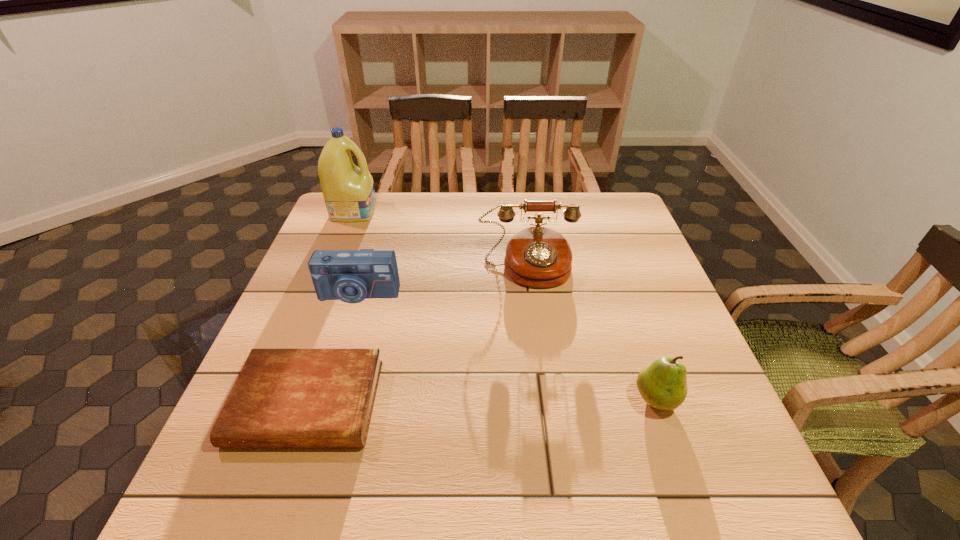
Locate an element on the screen. vacant space at the right edge of the desktop is located at coordinates (717, 417).

Locate an element on the screen. vacant space at the far left corner of the desktop is located at coordinates (385, 197).

The width and height of the screenshot is (960, 540). In order to click on vacant area at the far right corner of the desktop in this screenshot , I will do `click(587, 199)`.

The width and height of the screenshot is (960, 540). I want to click on vacant point located between the rightmost object and the second object from right to left, so pyautogui.click(x=592, y=333).

Where is `vacant region between the Bible and the telephone`? Image resolution: width=960 pixels, height=540 pixels. vacant region between the Bible and the telephone is located at coordinates (418, 335).

Locate an element on the screen. vacant space that is in between the camera and the rightmost object is located at coordinates (507, 347).

The width and height of the screenshot is (960, 540). In order to click on vacant area that lies between the shortest object and the camera in this screenshot , I will do `click(332, 349)`.

You are a GUI agent. You are given a task and a screenshot of the screen. Output one action in this format:
    pyautogui.click(x=<x>, y=<y>)
    Task: Click on the free spot between the second object from right to left and the camera
    The image size is (960, 540).
    Given the screenshot: What is the action you would take?
    pyautogui.click(x=444, y=280)

At what (x,y) coordinates should I click in order to perform the action: click on free spot between the rightmost object and the shortest object. Please return your answer as a coordinate pair (x, y). The width and height of the screenshot is (960, 540). Looking at the image, I should click on (482, 401).

Locate an element on the screen. The width and height of the screenshot is (960, 540). free spot between the fourth shortest object and the detergent is located at coordinates (442, 239).